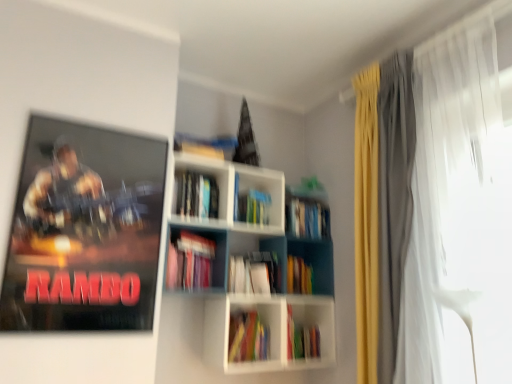
Question: Is the position of white plastic bookcase at center less distant than that of matte pink book at center, acting as the 4th book starting from the bottom?

Choices:
 (A) yes
 (B) no

Answer: (A)

Question: Is white plastic bookcase at center outside of matte pink book at center, acting as the 4th book starting from the bottom?

Choices:
 (A) no
 (B) yes

Answer: (B)

Question: Does white plastic bookcase at center contain matte pink book at center, acting as the 4th book starting from the bottom?

Choices:
 (A) no
 (B) yes

Answer: (B)

Question: Does white plastic bookcase at center have a larger size compared to matte pink book at center, positioned as the third book in top-to-bottom order?

Choices:
 (A) no
 (B) yes

Answer: (B)

Question: From a real-world perspective, does white plastic bookcase at center sit lower than matte pink book at center, positioned as the third book in top-to-bottom order?

Choices:
 (A) yes
 (B) no

Answer: (B)

Question: Is hardcover book at center, which is the 5th book from bottom to top, inside or outside of white matte bookshelf at center, acting as the 6th book starting from the bottom?

Choices:
 (A) inside
 (B) outside

Answer: (B)

Question: From their relative heights in the image, would you say hardcover book at center, which ranks as the 2th book in top-to-bottom order, is taller or shorter than white matte bookshelf at center, acting as the first book starting from the top?

Choices:
 (A) tall
 (B) short

Answer: (B)

Question: In the image, is hardcover book at center, which is the 5th book from bottom to top, on the left side or the right side of white matte bookshelf at center, acting as the first book starting from the top?

Choices:
 (A) left
 (B) right

Answer: (B)

Question: From a real-world perspective, is hardcover book at center, which is the 5th book from bottom to top, positioned above or below white matte bookshelf at center, acting as the first book starting from the top?

Choices:
 (A) below
 (B) above

Answer: (A)

Question: From a real-world perspective, is white matte bookshelf at center, acting as the first book starting from the top, positioned above or below multicolored paper at center, positioned as the sixth book in top-to-bottom order?

Choices:
 (A) above
 (B) below

Answer: (A)

Question: Based on their positions, is white matte bookshelf at center, acting as the 6th book starting from the bottom, located to the left or right of multicolored paper at center, positioned as the sixth book in top-to-bottom order?

Choices:
 (A) left
 (B) right

Answer: (A)

Question: Do you think white matte bookshelf at center, acting as the first book starting from the top, is within multicolored paper at center, placed as the first book when sorted from bottom to top, or outside of it?

Choices:
 (A) outside
 (B) inside

Answer: (A)

Question: Relative to multicolored paper at center, positioned as the sixth book in top-to-bottom order, is white matte bookshelf at center, acting as the 6th book starting from the bottom, in front or behind?

Choices:
 (A) behind
 (B) front

Answer: (B)

Question: Considering their positions, is multicolored paper at center, positioned as the fifth book in top-to-bottom order, located in front of or behind matte pink book at center, acting as the 4th book starting from the bottom?

Choices:
 (A) behind
 (B) front

Answer: (A)

Question: Is multicolored paper at center, marked as the 2th book in a bottom-to-top arrangement, to the left or to the right of matte pink book at center, acting as the 4th book starting from the bottom, in the image?

Choices:
 (A) left
 (B) right

Answer: (B)